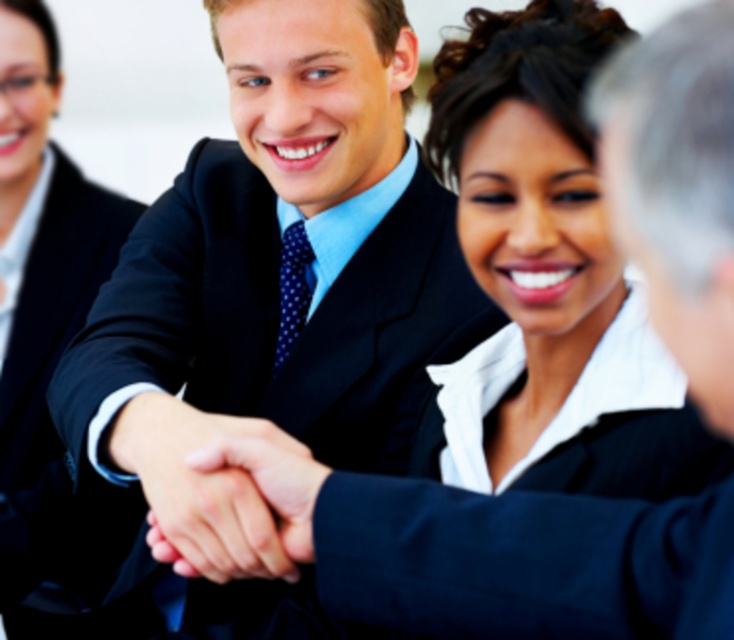
You are a photographer at a formal event. You need to capture a photo of the black smooth suit at center and the smooth skin handshake at center. Which object should you focus on first if you want to ensure both are in focus, given that your camera can only focus on one subject at a time?

The black smooth suit at center is to the left of the smooth skin handshake at center, so you should focus on the black smooth suit at center first to ensure both are in focus.

You are an event planner organizing a formal event and need to ensure that the seating arrangement accommodates the width of both the black satin business suit at center and the black smooth suit at center. Which suit requires a wider seat?

The black satin business suit at center requires a wider seat since its width surpasses that of the black smooth suit at center.

You are standing at the origin point in the image and want to reach the point labeled as point (x=327, y=621) first before moving to point (x=7, y=276). Which direction should you head first?

Since point (x=327, y=621) is in front of point (x=7, y=276), you should head towards point (x=327, y=621) first by moving forward from the origin point.